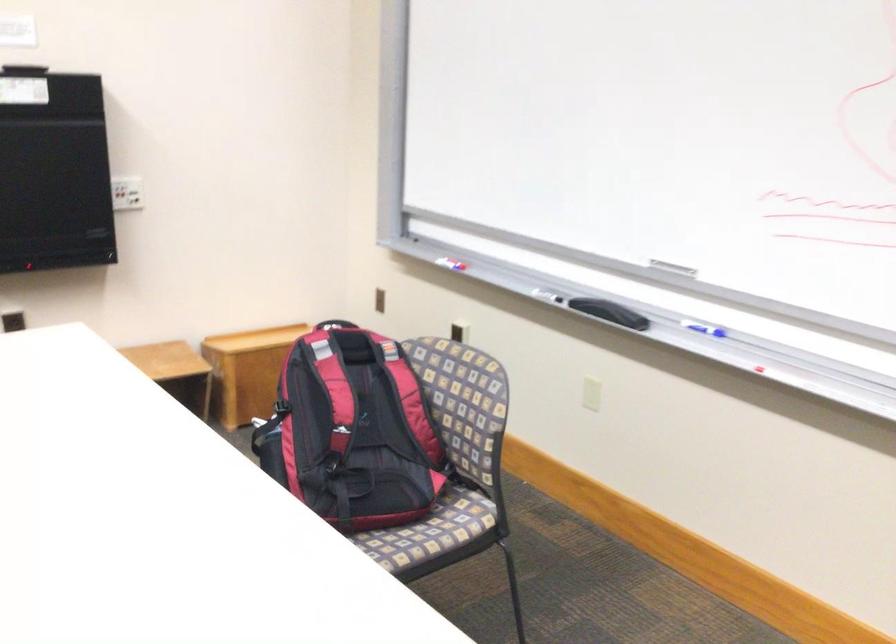
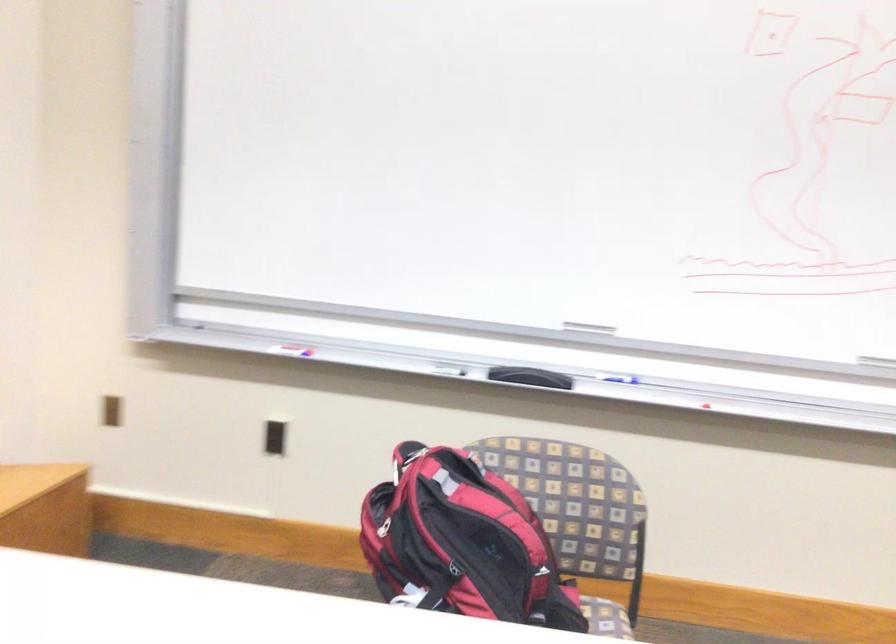
Question: I am providing you with two images of the same scene from different viewpoints. After the viewpoint changes to image2, which objects are now occluded?

Choices:
 (A) black whiteboard eraser
 (B) black wall outlet
 (C) red and black backpack
 (D) none of these

Answer: (D)